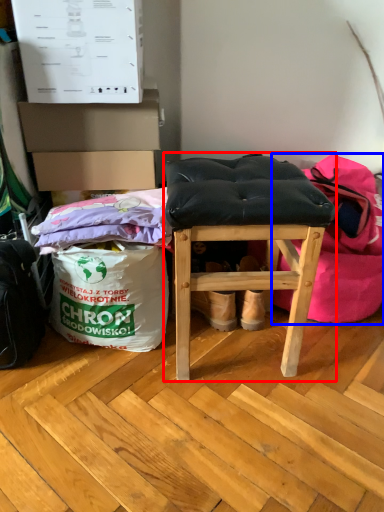
Question: Which of the following is the closest to the observer, furniture (highlighted by a red box) or bean bag chair (highlighted by a blue box)?

Choices:
 (A) furniture
 (B) bean bag chair

Answer: (A)